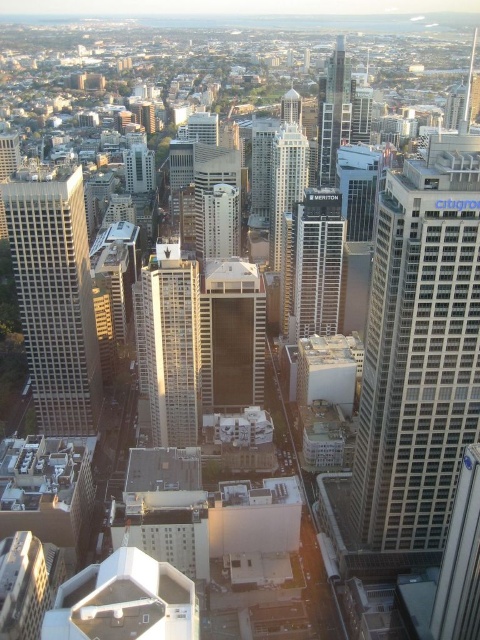
Question: Can you confirm if smooth glass skyscraper at center is positioned to the right of glassy silver skyscraper at center?

Choices:
 (A) no
 (B) yes

Answer: (A)

Question: Which point is farther from the camera taking this photo?

Choices:
 (A) (309, 273)
 (B) (396, 388)
 (C) (39, 220)

Answer: (A)

Question: Estimate the real-world distances between objects in this image. Which object is farther from the metallic glass skyscraper at right?

Choices:
 (A) matte glass skyscraper at left
 (B) smooth glass skyscraper at center
 (C) metallic glass skyscraper at center

Answer: (C)

Question: Can you confirm if glassy silver skyscraper at center is smaller than shiny glass skyscraper at center?

Choices:
 (A) yes
 (B) no

Answer: (A)

Question: Does smooth glass skyscraper at center appear over shiny glass skyscraper at center?

Choices:
 (A) no
 (B) yes

Answer: (A)

Question: Which of the following is the closest to the observer?

Choices:
 (A) metallic glass skyscraper at right
 (B) smooth glass skyscraper at center
 (C) matte glass skyscraper at left

Answer: (A)